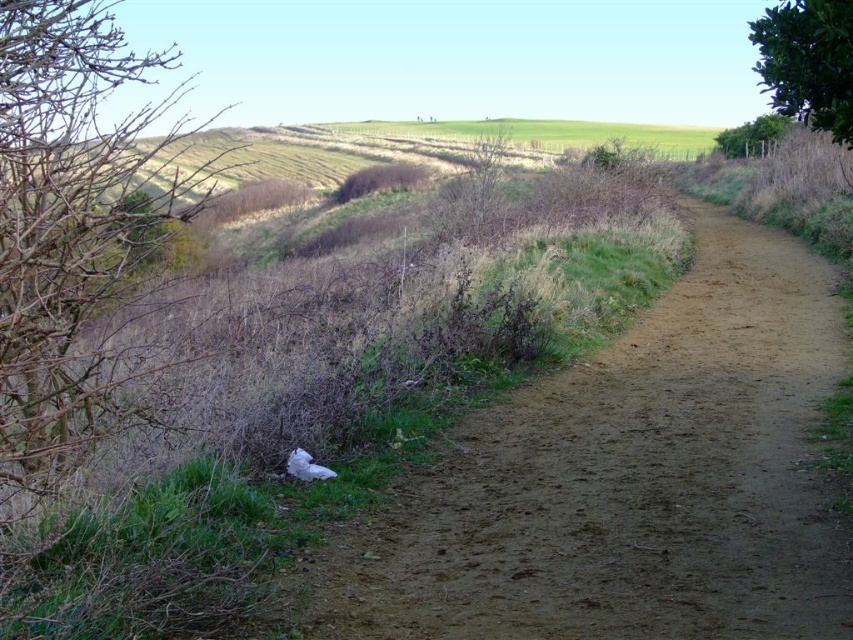
Which is in front, point (764, 387) or point (335, 196)?

Point (764, 387) is in front.

How far apart are brown dirt track at center and brown dry hedge at center?

brown dirt track at center is 28.76 meters away from brown dry hedge at center.

Is point (555, 465) behind point (389, 172)?

No.

Find the location of a particular element. Image resolution: width=853 pixels, height=640 pixels. brown dirt track at center is located at coordinates (628, 481).

Is brown dirt track at center thinner than brown dry branches at left?

Correct, brown dirt track at center's width is less than brown dry branches at left's.

Which is more to the right, brown dirt track at center or brown dry branches at left?

brown dirt track at center

Identify the location of brown dirt track at center. coord(628,481).

Is point (20, 326) closer to camera compared to point (758, 147)?

That is True.

Between point (107, 262) and point (749, 141), which one is positioned in front?

Point (107, 262) is in front.

Locate an element on the screen. Image resolution: width=853 pixels, height=640 pixels. brown dry branches at left is located at coordinates (70, 228).